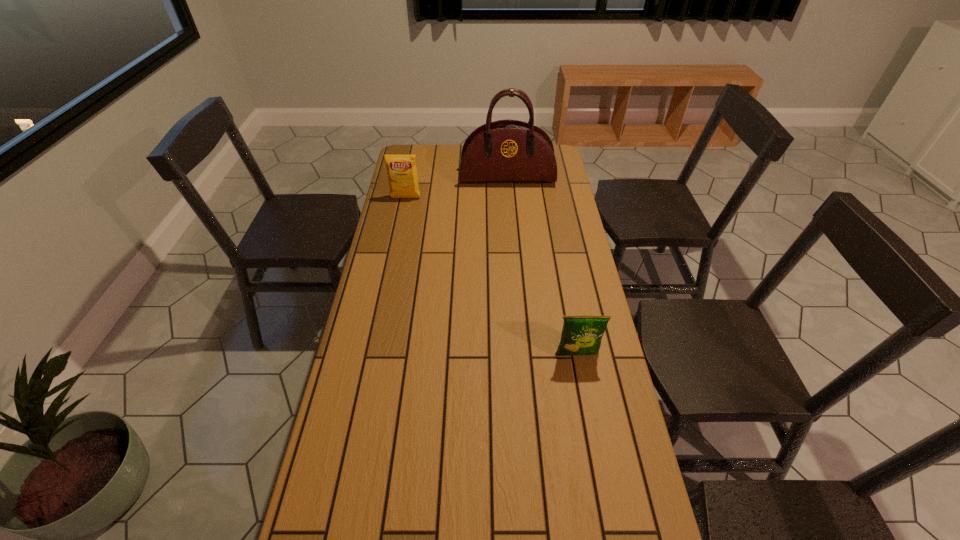
Where is `object situated at the left edge`? The width and height of the screenshot is (960, 540). object situated at the left edge is located at coordinates (401, 169).

You are a GUI agent. You are given a task and a screenshot of the screen. Output one action in this format:
    pyautogui.click(x=<x>, y=<y>)
    Task: Click on the handbag present at the right edge
    
    Given the screenshot: What is the action you would take?
    pyautogui.click(x=508, y=150)

You are a GUI agent. You are given a task and a screenshot of the screen. Output one action in this format:
    pyautogui.click(x=<x>, y=<y>)
    Task: Click on the crisp (potato chip) that is at the right edge
    The width and height of the screenshot is (960, 540).
    Given the screenshot: What is the action you would take?
    pyautogui.click(x=581, y=335)

The height and width of the screenshot is (540, 960). I want to click on object that is at the far right corner, so click(x=508, y=150).

The height and width of the screenshot is (540, 960). I want to click on vacant point at the left edge, so click(x=399, y=291).

At what (x,y) coordinates should I click in order to perform the action: click on vacant space at the right edge of the desktop. Please return your answer as a coordinate pair (x, y). Looking at the image, I should click on (540, 228).

Identify the location of blank space at the far left corner. This screenshot has width=960, height=540. (428, 145).

Identify the location of vacant area that lies between the tallest object and the right crisp (potato chip). Image resolution: width=960 pixels, height=540 pixels. (542, 266).

Find the location of a particular element. free space between the tallest object and the left crisp (potato chip) is located at coordinates (456, 188).

The image size is (960, 540). Identify the location of vacant region between the second farthest object and the nearer crisp (potato chip). (492, 276).